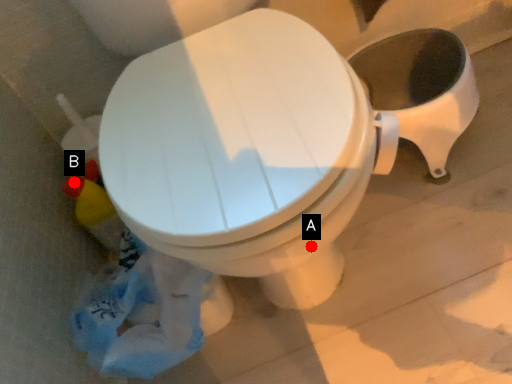
Question: Two points are circled on the image, labeled by A and B beside each circle. Which point is closer to the camera?

Choices:
 (A) A is closer
 (B) B is closer

Answer: (A)